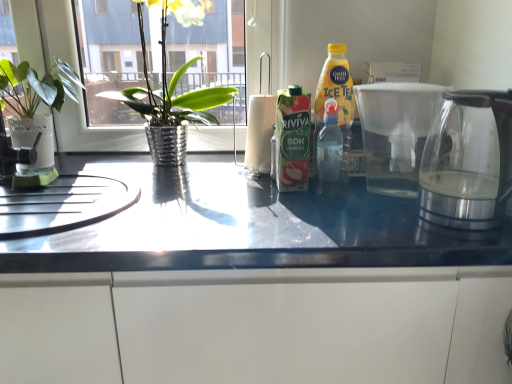
Question: From a real-world perspective, is glossy white cabinet at lower center positioned above or below green cardboard carton at center?

Choices:
 (A) above
 (B) below

Answer: (B)

Question: Is glossy white cabinet at lower center bigger or smaller than green cardboard carton at center?

Choices:
 (A) small
 (B) big

Answer: (B)

Question: Which is farther from the transparent glass coffeepot at right, placed as the 2th coffeepot when sorted from front to back?

Choices:
 (A) white textured pot at left, the first houseplant in the left-to-right sequence
 (B) transparent glass kettle at right, the first coffeepot positioned from the front
 (C) metallic silver pot at left, which appears as the 1th houseplant when viewed from the right
 (D) glossy white cabinet at lower center
 (E) green cardboard carton at center

Answer: (A)

Question: Estimate the real-world distances between objects in this image. Which object is farther from the transparent glass coffeepot at right, placed as the 1th coffeepot when sorted from back to front?

Choices:
 (A) transparent glass kettle at right, which is counted as the 2th coffeepot, starting from the back
 (B) metallic silver pot at left, which ranks as the second houseplant in left-to-right order
 (C) green cardboard carton at center
 (D) glossy white cabinet at lower center
 (E) white textured pot at left, the first houseplant in the left-to-right sequence

Answer: (E)